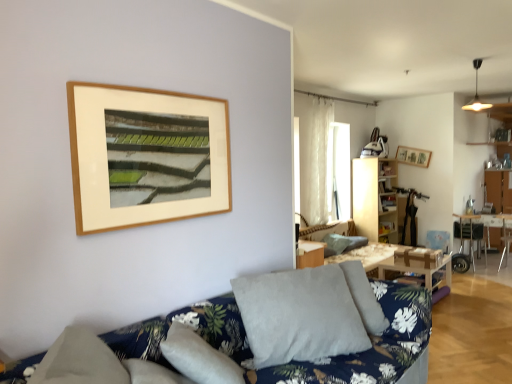
This screenshot has height=384, width=512. Describe the element at coordinates (482, 229) in the screenshot. I see `wooden table at right, arranged as the 2th table when viewed from the left` at that location.

The image size is (512, 384). Describe the element at coordinates (315, 159) in the screenshot. I see `white sheer curtain at upper center` at that location.

Measure the distance between point (509, 235) and camera.

Point (509, 235) and camera are 6.98 meters apart from each other.

Locate an element on the screen. This screenshot has width=512, height=384. wooden picture frame at upper right is located at coordinates (413, 156).

Does white sheer curtain at upper center have a greater width compared to wooden bookshelf at center-right?

In fact, white sheer curtain at upper center might be narrower than wooden bookshelf at center-right.

Is the surface of white sheer curtain at upper center in direct contact with wooden bookshelf at center-right?

There is a gap between white sheer curtain at upper center and wooden bookshelf at center-right.

Is white sheer curtain at upper center aimed at wooden bookshelf at center-right?

No, white sheer curtain at upper center does not turn towards wooden bookshelf at center-right.

Considering the relative positions of white sheer curtain at upper center and wooden bookshelf at center-right in the image provided, is white sheer curtain at upper center in front of wooden bookshelf at center-right?

That is True.

Is gray fabric pillow at center, placed as the second pillow when sorted from right to left, positioned in front of wooden table at right, arranged as the first table when viewed from the right?

Yes, it is in front of wooden table at right, arranged as the first table when viewed from the right.

Can wooden table at right, arranged as the 2th table when viewed from the left, be found inside gray fabric pillow at center, the first pillow when ordered from front to back?

No, wooden table at right, arranged as the 2th table when viewed from the left, is not inside gray fabric pillow at center, the first pillow when ordered from front to back.

Looking at this image, does gray fabric pillow at center, placed as the second pillow when sorted from right to left, have a greater height compared to wooden table at right, arranged as the first table when viewed from the right?

In fact, gray fabric pillow at center, placed as the second pillow when sorted from right to left, may be shorter than wooden table at right, arranged as the first table when viewed from the right.

Between wooden table at right, arranged as the first table when viewed from the right, and metallic silver armchair at lower right, which one has more height?

Standing taller between the two is metallic silver armchair at lower right.

From the image's perspective, count 1st tables downward from the metallic silver armchair at lower right and point to it. Please provide its 2D coordinates.

[(482, 229)]

Looking at this image, is metallic silver armchair at lower right placed right next to wooden table at center, the 2th table in the right-to-left sequence?

No, metallic silver armchair at lower right is not in contact with wooden table at center, the 2th table in the right-to-left sequence.

Is wooden table at center, the 2th table in the right-to-left sequence, a part of metallic silver armchair at lower right?

No, wooden table at center, the 2th table in the right-to-left sequence, is located outside of metallic silver armchair at lower right.

From a real-world perspective, which object stands above the other?

metallic silver armchair at lower right, from a real-world perspective.

Considering the relative positions of metallic silver armchair at lower right and wooden table at center, which ranks as the 1th table in left-to-right order, in the image provided, is metallic silver armchair at lower right to the right of wooden table at center, which ranks as the 1th table in left-to-right order, from the viewer's perspective?

Yes, metallic silver armchair at lower right is to the right of wooden table at center, which ranks as the 1th table in left-to-right order.

Is gray fabric pillow at center, the first pillow when ordered from front to back, situated inside metallic silver armchair at lower right or outside?

gray fabric pillow at center, the first pillow when ordered from front to back, is outside metallic silver armchair at lower right.

Is gray fabric pillow at center, placed as the second pillow when sorted from right to left, turned away from metallic silver armchair at lower right?

No, metallic silver armchair at lower right is not at the back of gray fabric pillow at center, placed as the second pillow when sorted from right to left.

How many degrees apart are the facing directions of floral fabric couch at lower center and metallic silver chair at right?

The facing directions of floral fabric couch at lower center and metallic silver chair at right are 3.18 degrees apart.

Who is smaller, floral fabric couch at lower center or metallic silver chair at right?

With smaller size is metallic silver chair at right.

Consider the image. Does floral fabric couch at lower center have a greater width compared to metallic silver chair at right?

Yes.

Looking at this image, which of these two, wooden table at center, which ranks as the 1th table in left-to-right order, or metallic silver chair at right, is wider?

wooden table at center, which ranks as the 1th table in left-to-right order.

Looking at this image, from the image's perspective, between wooden table at center, which ranks as the 1th table in left-to-right order, and metallic silver chair at right, who is located below?

wooden table at center, which ranks as the 1th table in left-to-right order, appears lower in the image.

In the image, is wooden table at center, the second table from the back, on the left side or the right side of metallic silver chair at right?

wooden table at center, the second table from the back, is to the left of metallic silver chair at right.

Can you confirm if wooden table at center, the second table from the back, is smaller than metallic silver chair at right?

No.

At what (x,y) coordinates should I click in order to perform the action: click on curtain in front of the wooden bookshelf at center-right. Please return your answer as a coordinate pair (x, y). This screenshot has width=512, height=384. Looking at the image, I should click on (315, 159).

I want to click on the 2nd table to the right of the gray fabric pillow at center, the first pillow when ordered from front to back, starting your count from the anchor, so click(x=482, y=229).

Based on their spatial positions, is wooden table at right, the 2th table viewed from the front, or gray fabric pillow at center, placed as the second pillow when sorted from right to left, closer to wooden picture frame at upper right?

wooden table at right, the 2th table viewed from the front, is positioned closer to the anchor wooden picture frame at upper right.

When comparing their distances from metallic silver armchair at lower right, does wooden table at right, placed as the 1th table when sorted from back to front, or floral fabric couch at lower center seem further?

floral fabric couch at lower center.

When comparing their distances from wooden table at right, arranged as the first table when viewed from the right, does metallic silver armchair at lower right or textured gray pillow at center, which appears as the 2th pillow when viewed from the left, seem further?

textured gray pillow at center, which appears as the 2th pillow when viewed from the left, is further to wooden table at right, arranged as the first table when viewed from the right.

Based on their spatial positions, is wooden bookshelf at center-right or wooden table at center, which ranks as the 1th table in left-to-right order, closer to floral fabric couch at lower center?

wooden table at center, which ranks as the 1th table in left-to-right order, lies closer to floral fabric couch at lower center than the other object.

Based on their spatial positions, is wooden table at right, the 2th table viewed from the front, or wooden picture frame at upper right further from floral fabric couch at lower center?

The object further to floral fabric couch at lower center is wooden table at right, the 2th table viewed from the front.

Based on their spatial positions, is gray fabric pillow at center, the first pillow viewed from the left, or metallic silver chair at right further from white sheer curtain at upper center?

The object further to white sheer curtain at upper center is gray fabric pillow at center, the first pillow viewed from the left.

From the image, which object appears to be farther from floral fabric couch at lower center, wooden bookshelf at center-right or white sheer curtain at upper center?

Among the two, wooden bookshelf at center-right is located further to floral fabric couch at lower center.

From the image, which object appears to be nearer to white sheer curtain at upper center, wooden table at right, placed as the 1th table when sorted from back to front, or floral fabric couch at lower center?

The object closer to white sheer curtain at upper center is wooden table at right, placed as the 1th table when sorted from back to front.

In order to click on chair positioned between floral fabric couch at lower center and wooden table at right, placed as the 1th table when sorted from back to front, from near to far in this screenshot , I will do `click(469, 242)`.

Identify the location of curtain between floral fabric couch at lower center and wooden picture frame at upper right along the z-axis. (315, 159).

Identify the location of cabinetry located between wooden table at center, the 2th table in the right-to-left sequence, and wooden picture frame at upper right in the depth direction. The height and width of the screenshot is (384, 512). (375, 198).

The image size is (512, 384). Find the location of `curtain positioned between floral fabric couch at lower center and wooden bookshelf at center-right from near to far`. curtain positioned between floral fabric couch at lower center and wooden bookshelf at center-right from near to far is located at coordinates (315, 159).